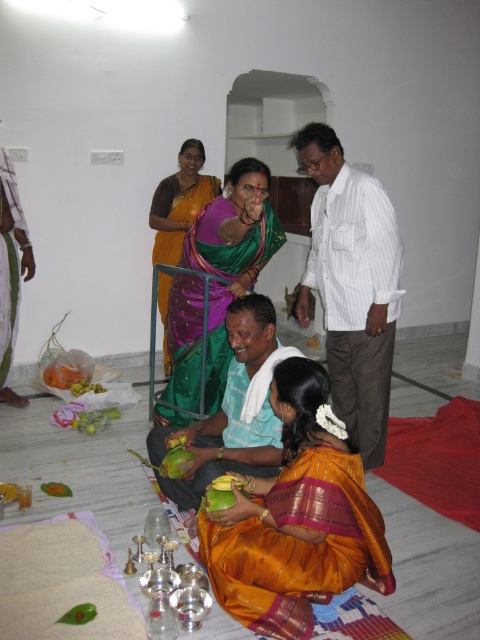
Question: Estimate the real-world distances between objects in this image. Which object is closer to the silky purple sari at center?

Choices:
 (A) yellow matte coconut at lower left
 (B) golden silk saree at center
 (C) green silk saree at center

Answer: (C)

Question: Which point appears farthest from the camera in this image?

Choices:
 (A) (16, 490)
 (B) (27, 273)

Answer: (B)

Question: Considering the relative positions of white striped shirt at upper center and green silk saree at center in the image provided, where is white striped shirt at upper center located with respect to green silk saree at center?

Choices:
 (A) left
 (B) right

Answer: (B)

Question: Which point is closer to the camera?

Choices:
 (A) green silk saree at center
 (B) green silk saree at upper center
 (C) white striped shirt at upper center
 (D) silky purple sari at center

Answer: (A)

Question: Is the position of white striped shirt at upper center less distant than that of green fabric cloth at center?

Choices:
 (A) no
 (B) yes

Answer: (A)

Question: Is green fabric cloth at center below silky purple sari at center?

Choices:
 (A) yes
 (B) no

Answer: (A)